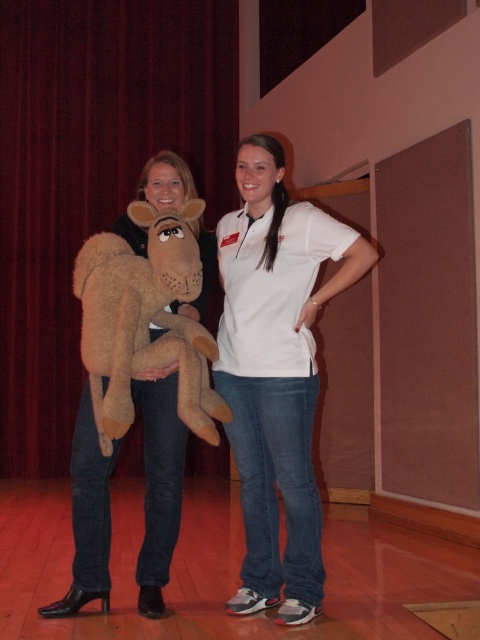
You are a stagehand setting up equipment for a performance. You need to position a camera so that it is exactly 25 feet away from the dark red velvet curtain at upper left. Based on the current setup, is the camera already positioned correctly?

The dark red velvet curtain at upper left and camera are 24.29 feet apart from each other. Since 24.29 feet is less than 25 feet, the camera is not positioned correctly and needs to be moved further away to meet the required distance.

You are an actor standing on stage and need to exit through a door located at the upper left corner. The dark red velvet curtain at upper left is blocking your path. Can you move around it to reach the door?

The dark red velvet curtain at upper left is located at point (92, 173), so you can move around it to reach the door at the upper left corner.

You are directing a play and need to adjust the lighting. Which object is closer to the audience between the dark red velvet curtain at upper left and the white cotton shirt at center?

The dark red velvet curtain at upper left is closer to the audience than the white cotton shirt at center.